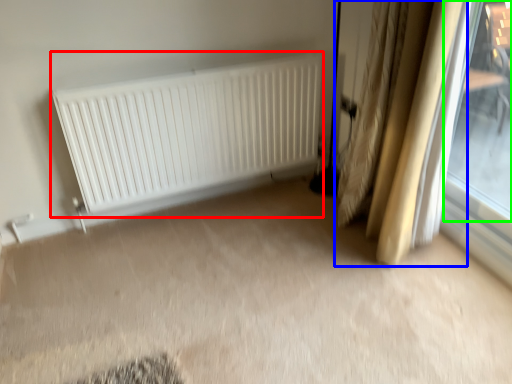
Question: Based on their relative distances, which object is nearer to radiator (highlighted by a red box)? Choose from curtain (highlighted by a blue box) and window (highlighted by a green box).

Choices:
 (A) curtain
 (B) window

Answer: (A)